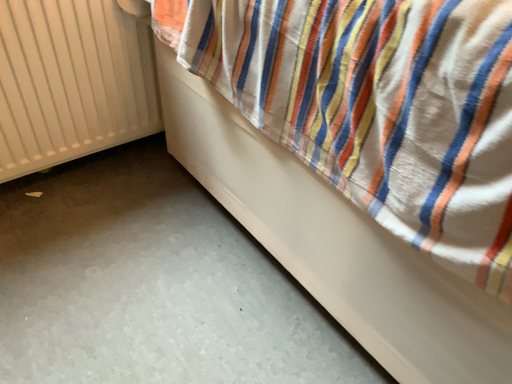
Question: Is white matte radiator at left positioned beyond the bounds of white smooth bed at lower right?

Choices:
 (A) no
 (B) yes

Answer: (B)

Question: From a real-world perspective, is white matte radiator at left on white smooth bed at lower right?

Choices:
 (A) yes
 (B) no

Answer: (B)

Question: Could you tell me if white matte radiator at left is facing white smooth bed at lower right?

Choices:
 (A) no
 (B) yes

Answer: (A)

Question: Is white matte radiator at left further to camera compared to white smooth bed at lower right?

Choices:
 (A) no
 (B) yes

Answer: (B)

Question: Is white matte radiator at left taller than white smooth bed at lower right?

Choices:
 (A) yes
 (B) no

Answer: (B)

Question: Is white matte radiator at left wider than white smooth bed at lower right?

Choices:
 (A) no
 (B) yes

Answer: (A)

Question: Is white smooth bed at lower right smaller than white matte radiator at left?

Choices:
 (A) no
 (B) yes

Answer: (A)

Question: Is white smooth bed at lower right positioned beyond the bounds of white matte radiator at left?

Choices:
 (A) yes
 (B) no

Answer: (A)

Question: From a real-world perspective, is white smooth bed at lower right positioned under white matte radiator at left based on gravity?

Choices:
 (A) no
 (B) yes

Answer: (A)

Question: Could white matte radiator at left be considered to be inside white smooth bed at lower right?

Choices:
 (A) no
 (B) yes

Answer: (A)

Question: Can you confirm if white smooth bed at lower right is wider than white matte radiator at left?

Choices:
 (A) yes
 (B) no

Answer: (A)

Question: From the image's perspective, would you say white smooth bed at lower right is shown under white matte radiator at left?

Choices:
 (A) no
 (B) yes

Answer: (A)

Question: Is point (257, 147) closer or farther from the camera than point (114, 89)?

Choices:
 (A) closer
 (B) farther

Answer: (A)